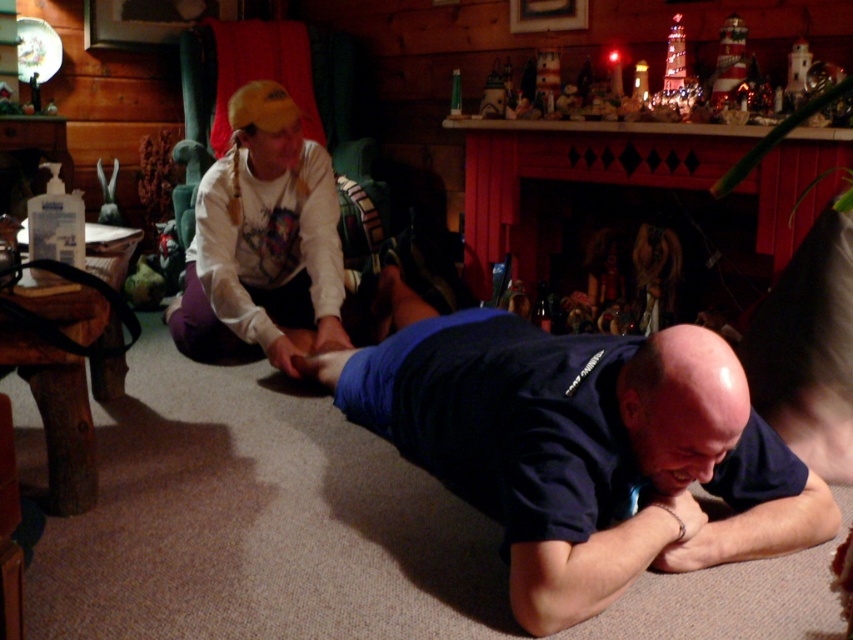
In the scene shown: Which is above, dark blue t-shirt at center or white cotton shirt at upper left?

Positioned higher is white cotton shirt at upper left.

The width and height of the screenshot is (853, 640). Identify the location of dark blue t-shirt at center. (625, 468).

Identify the location of dark blue t-shirt at center. (625, 468).